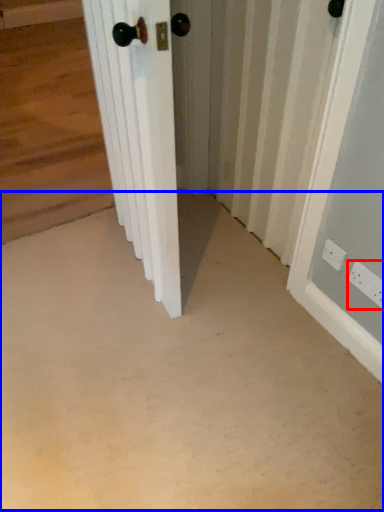
Question: Among these objects, which one is farthest to the camera, electric outlet (highlighted by a red box) or concrete (highlighted by a blue box)?

Choices:
 (A) electric outlet
 (B) concrete

Answer: (A)